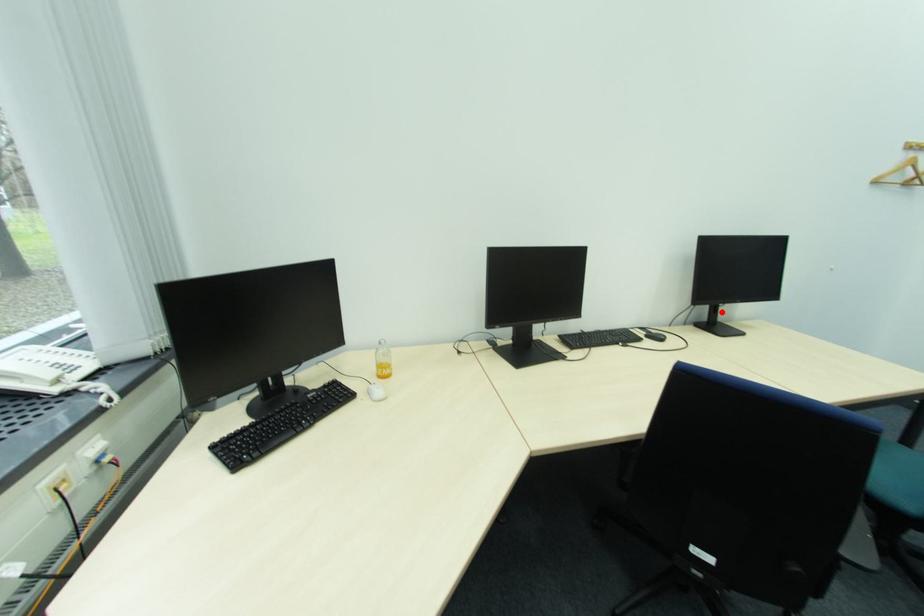
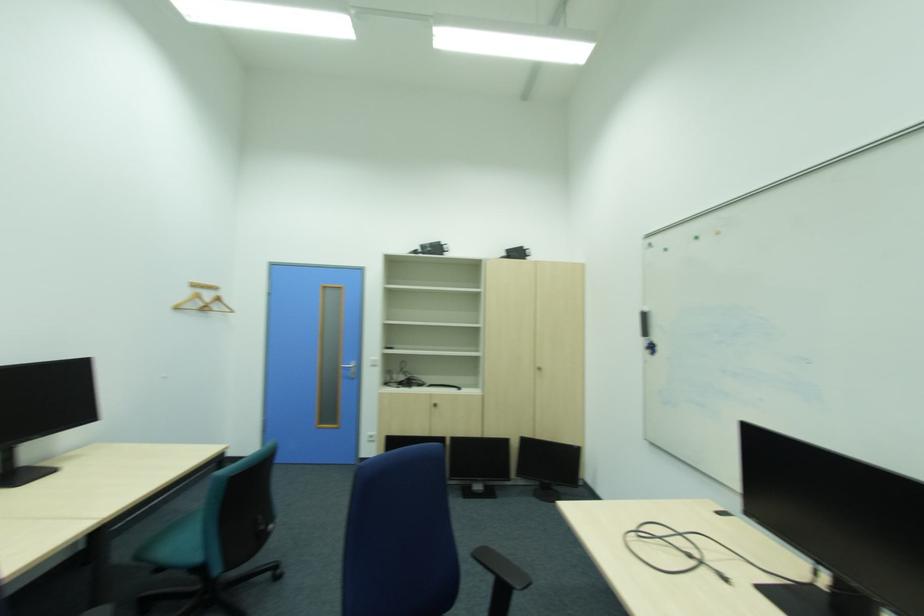
Question: I am providing you with two images of the same scene from different viewpoints. A red point is marked on the first image. At the location where the point appears in image 1, is it still visible in image 2?

Choices:
 (A) Yes
 (B) No

Answer: (A)